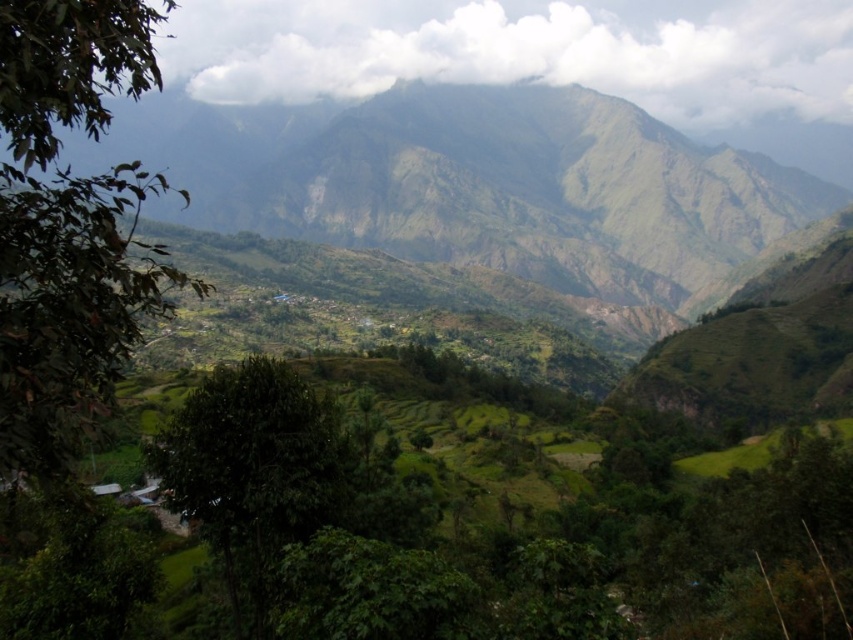
Question: Among these points, which one is nearest to the camera?

Choices:
 (A) (567, 132)
 (B) (108, 390)
 (C) (294, 509)

Answer: (B)

Question: Which point is closer to the camera?

Choices:
 (A) green leafy tree at left
 (B) green leafy tree at center
 (C) green grassy mountain at center

Answer: (A)

Question: Is green leafy tree at left positioned before green leafy tree at center?

Choices:
 (A) no
 (B) yes

Answer: (B)

Question: Considering the relative positions of green grassy mountain at center and green leafy tree at center in the image provided, where is green grassy mountain at center located with respect to green leafy tree at center?

Choices:
 (A) left
 (B) right

Answer: (B)

Question: Does green leafy tree at left have a lesser width compared to green leafy tree at center?

Choices:
 (A) yes
 (B) no

Answer: (B)

Question: Estimate the real-world distances between objects in this image. Which object is farther from the green leafy tree at center?

Choices:
 (A) green grassy mountain at center
 (B) green leafy tree at left

Answer: (A)